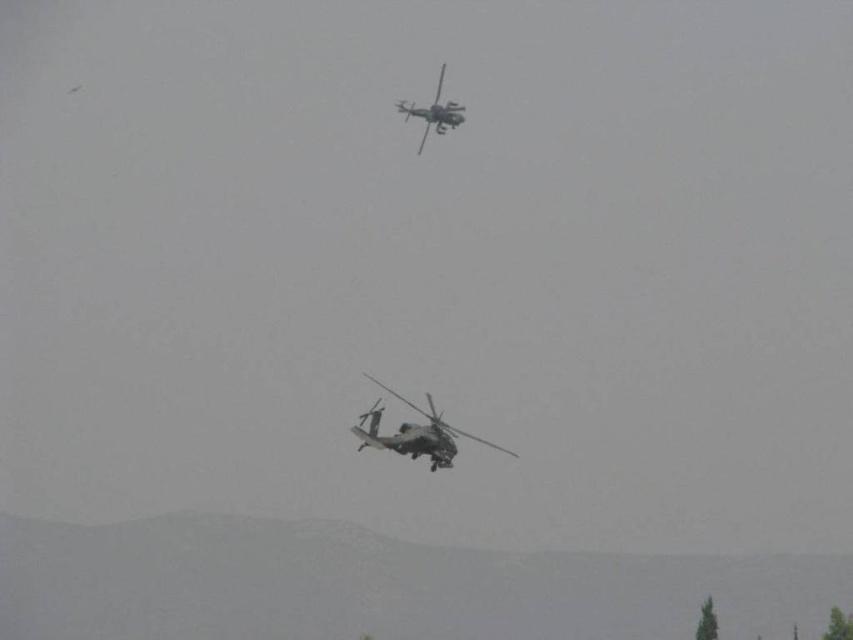
Where is `metallic gray helicopter at center`? metallic gray helicopter at center is located at coordinates (415, 433).

Can you confirm if metallic gray helicopter at center is thinner than camouflage fabric helicopter at upper center?

Yes.

Is point (427, 401) positioned after point (422, 134)?

No, (427, 401) is in front of (422, 134).

Find the location of a particular element. This screenshot has height=640, width=853. metallic gray helicopter at center is located at coordinates (415, 433).